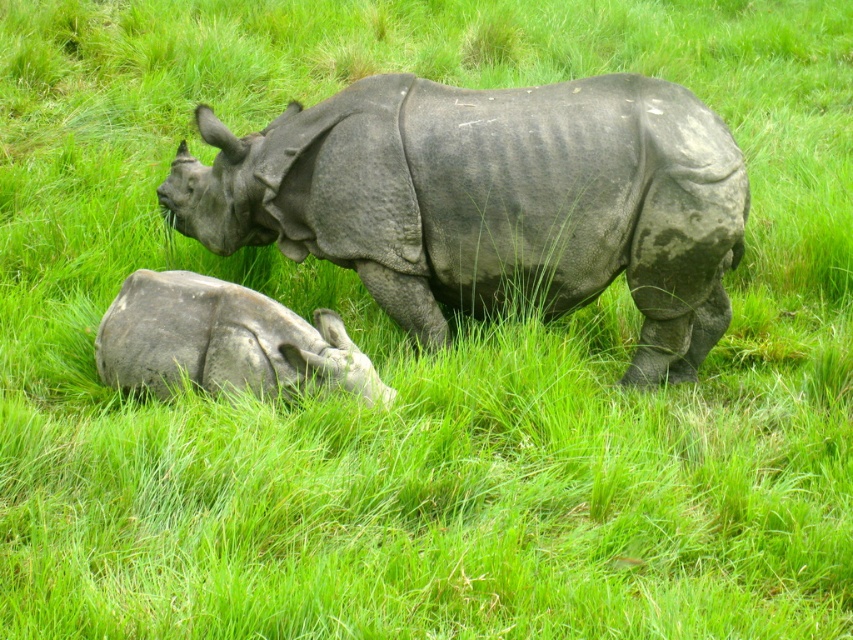
Who is shorter, gray textured rhino at center or gray matte rhino at lower left?

gray matte rhino at lower left is shorter.

Does gray textured rhino at center have a greater width compared to gray matte rhino at lower left?

Correct, the width of gray textured rhino at center exceeds that of gray matte rhino at lower left.

Image resolution: width=853 pixels, height=640 pixels. Describe the element at coordinates (491, 202) in the screenshot. I see `gray textured rhino at center` at that location.

Locate an element on the screen. gray textured rhino at center is located at coordinates (491, 202).